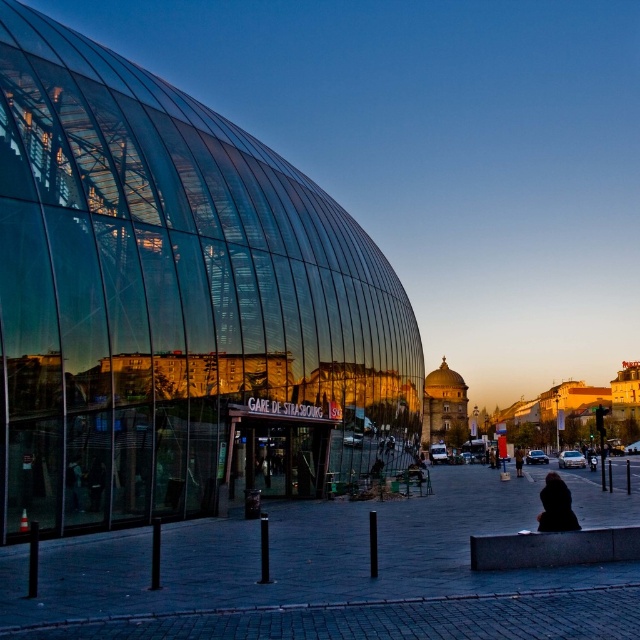
Between transparent glass building at left and black matte coat at lower right, which one is positioned lower?

black matte coat at lower right is below.

Who is positioned more to the right, transparent glass building at left or black matte coat at lower right?

Positioned to the right is black matte coat at lower right.

Does point (305, 426) come in front of point (552, 477)?

That is False.

Where is `transparent glass building at left`? This screenshot has height=640, width=640. transparent glass building at left is located at coordinates (177, 305).

From the picture: Is granite bench at lower right to the right of dark brown leather jacket at center from the viewer's perspective?

Incorrect, granite bench at lower right is not on the right side of dark brown leather jacket at center.

Is granite bench at lower right taller than dark brown leather jacket at center?

No, granite bench at lower right is not taller than dark brown leather jacket at center.

This screenshot has height=640, width=640. I want to click on granite bench at lower right, so click(554, 548).

Which is in front, point (173, 272) or point (518, 449)?

Point (173, 272)

Between transparent glass building at left and dark brown leather jacket at center, which one appears on the left side from the viewer's perspective?

From the viewer's perspective, transparent glass building at left appears more on the left side.

Find the location of a particular element. transparent glass building at left is located at coordinates (177, 305).

I want to click on transparent glass building at left, so click(177, 305).